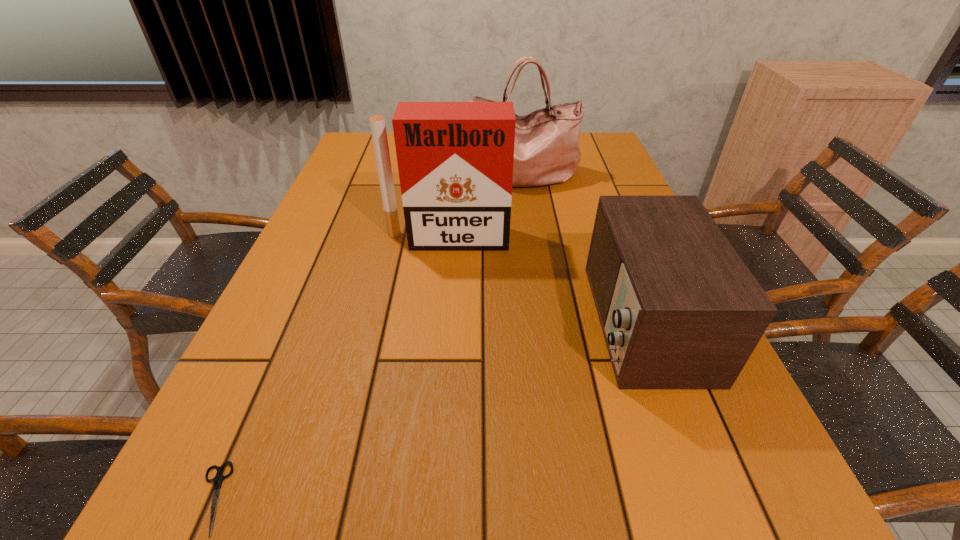
Locate an element on the screen. This screenshot has width=960, height=540. handbag is located at coordinates (546, 151).

Find the location of a particular element. The height and width of the screenshot is (540, 960). cigarette case is located at coordinates (455, 160).

Locate an element on the screen. the second shortest object is located at coordinates (679, 309).

Locate an element on the screen. The width and height of the screenshot is (960, 540). radio receiver is located at coordinates (679, 309).

Identify the location of the nearest object. The height and width of the screenshot is (540, 960). (217, 481).

The image size is (960, 540). Identify the location of shears. coord(217,481).

Identify the location of blank area located at the front of the handbag with handles. (532, 278).

The height and width of the screenshot is (540, 960). Identify the location of free space located 0.290m on the front-facing side of the second farthest object. (438, 339).

Find the location of a particular element. The height and width of the screenshot is (540, 960). blank space located 0.320m on the front-facing side of the second shortest object is located at coordinates (435, 321).

Image resolution: width=960 pixels, height=540 pixels. In order to click on free space located on the front-facing side of the second shortest object in this screenshot , I will do `click(444, 321)`.